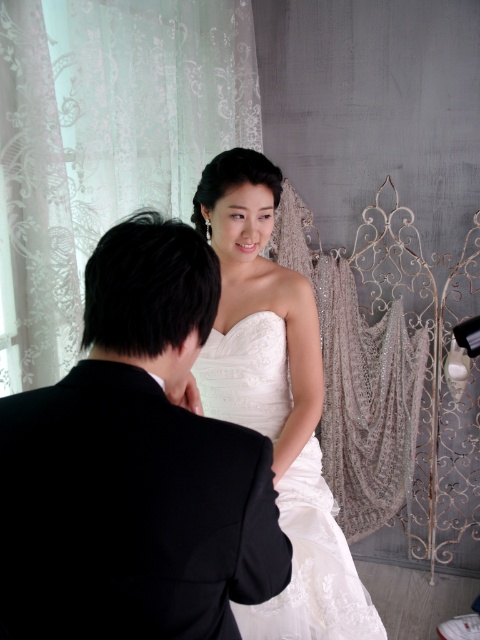
Measure the distance from black satin suit at center to satin/embroidered dress at center.

black satin suit at center is 72.58 centimeters away from satin/embroidered dress at center.

Between black satin suit at center and satin/embroidered dress at center, which one is positioned lower?

satin/embroidered dress at center

Which is in front, point (148, 314) or point (214, 356)?

Point (148, 314) is more forward.

This screenshot has width=480, height=640. Identify the location of black satin suit at center. (134, 467).